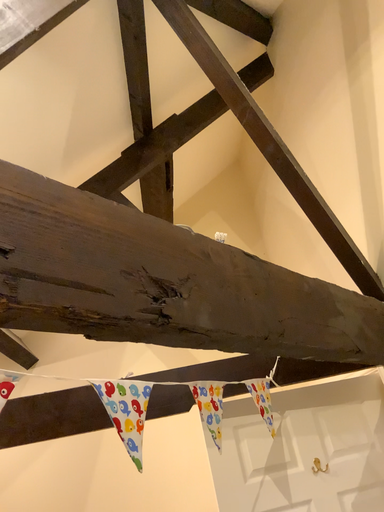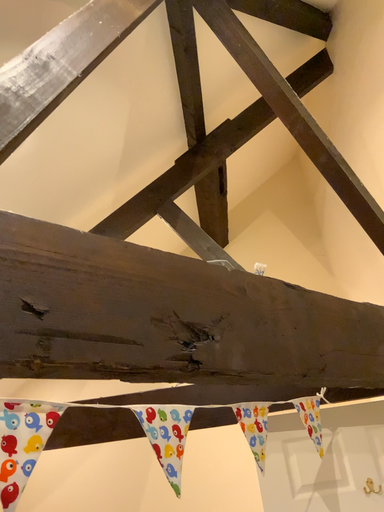
Question: How did the camera likely rotate when shooting the video?

Choices:
 (A) rotated right
 (B) rotated left

Answer: (B)